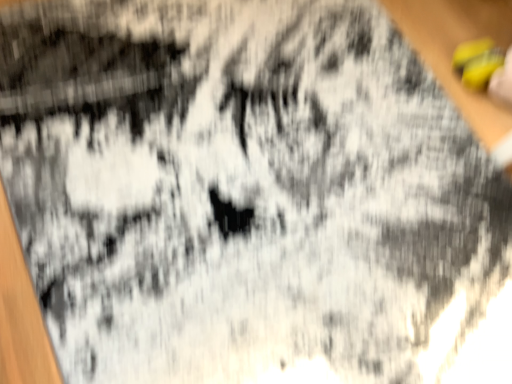
What do you see at coordinates (477, 62) in the screenshot?
I see `yellow rubber toy at upper right` at bounding box center [477, 62].

Where is `yellow rubber toy at upper right`? yellow rubber toy at upper right is located at coordinates (477, 62).

Measure the distance between point (463, 82) and camera.

Point (463, 82) is 1.26 meters from camera.

Where is `yellow rubber toy at upper right`? This screenshot has height=384, width=512. yellow rubber toy at upper right is located at coordinates (477, 62).